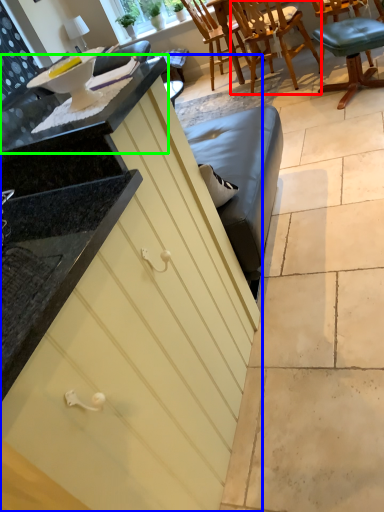
Question: Which object is positioned closest to chair (highlighted by a red box)? Select from cabinetry (highlighted by a blue box) and countertop (highlighted by a green box).

Choices:
 (A) cabinetry
 (B) countertop

Answer: (B)